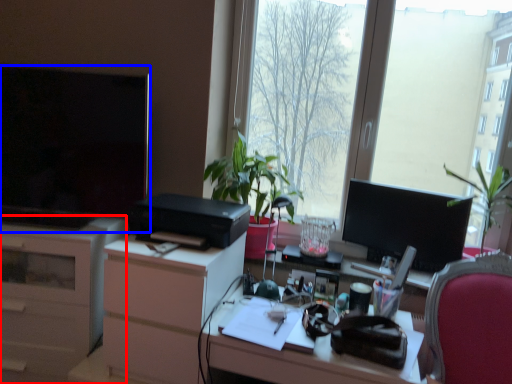
Question: Which object appears closest to the camera in this image, cabinetry (highlighted by a red box) or television (highlighted by a blue box)?

Choices:
 (A) cabinetry
 (B) television

Answer: (B)